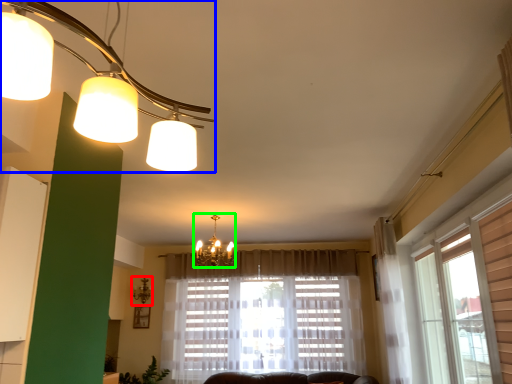
Question: Which is nearer to the lamp (highlighted by a red box)? lamp (highlighted by a blue box) or lamp (highlighted by a green box).

Choices:
 (A) lamp
 (B) lamp

Answer: (B)